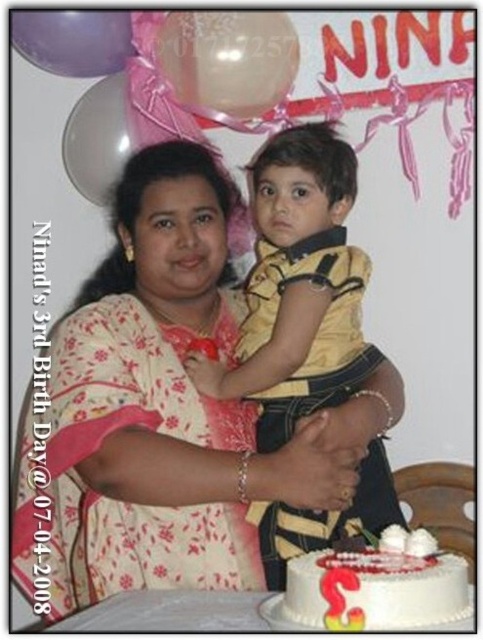
Who is more distant from viewer, (340,364) or (408,596)?

Positioned behind is point (340,364).

Does yellow smooth shirt at center appear on the right side of white frosted cake at lower right?

Incorrect, yellow smooth shirt at center is not on the right side of white frosted cake at lower right.

Describe the element at coordinates (298, 288) in the screenshot. This screenshot has width=483, height=640. I see `yellow smooth shirt at center` at that location.

This screenshot has height=640, width=483. Find the location of `yellow smooth shirt at center`. yellow smooth shirt at center is located at coordinates (298, 288).

Between floral fabric dress at center and yellow smooth shirt at center, which one appears on the right side from the viewer's perspective?

yellow smooth shirt at center is more to the right.

Can you confirm if floral fabric dress at center is wider than yellow smooth shirt at center?

Yes, floral fabric dress at center is wider than yellow smooth shirt at center.

Find the location of a particular element. This screenshot has height=640, width=483. floral fabric dress at center is located at coordinates (152, 412).

Where is `floral fabric dress at center`? floral fabric dress at center is located at coordinates (152, 412).

Which is more to the right, floral fabric dress at center or white frosted cake at lower right?

From the viewer's perspective, white frosted cake at lower right appears more on the right side.

Can you confirm if floral fabric dress at center is positioned to the right of white frosted cake at lower right?

In fact, floral fabric dress at center is to the left of white frosted cake at lower right.

What do you see at coordinates (152, 412) in the screenshot? I see `floral fabric dress at center` at bounding box center [152, 412].

Identify the location of floral fabric dress at center. This screenshot has width=483, height=640. (152, 412).